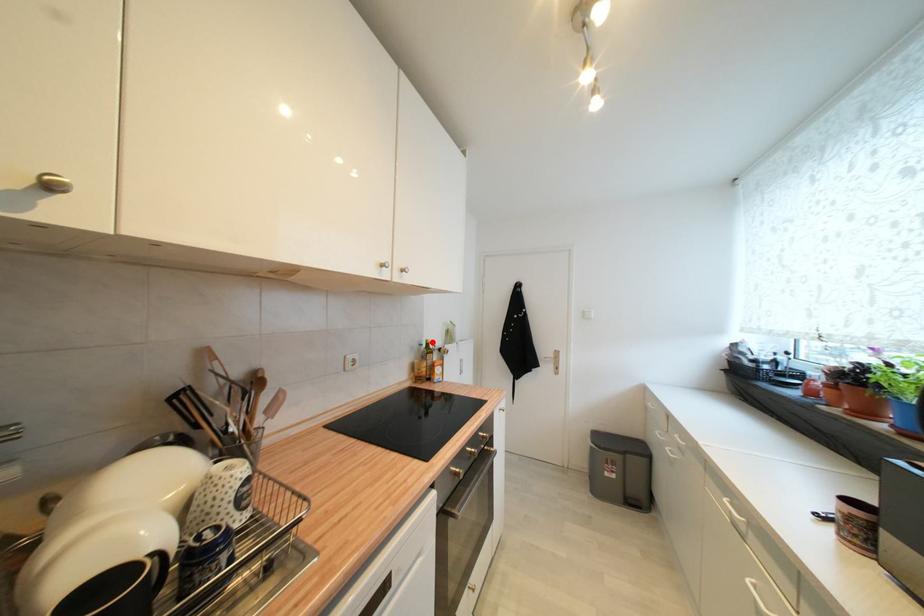
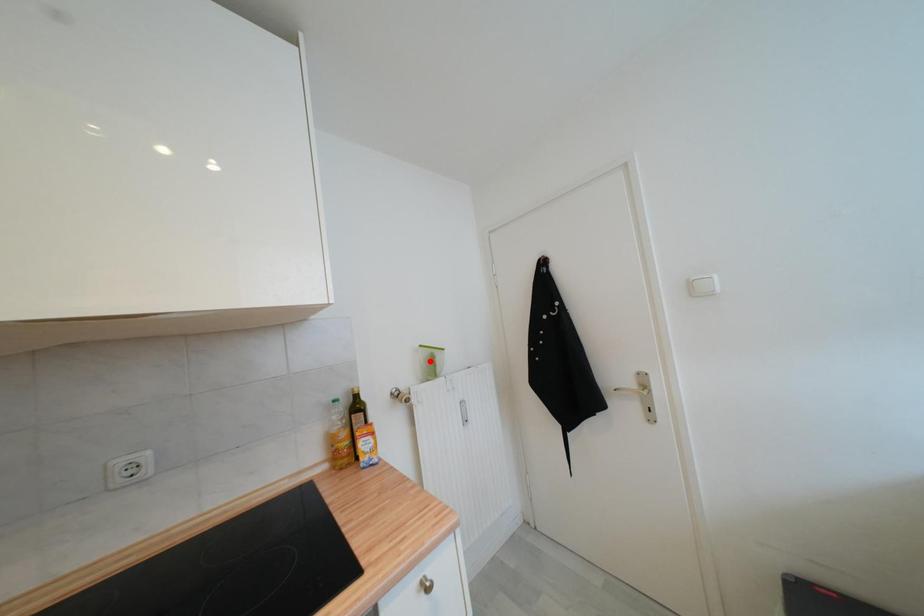
I am providing you with two images of the same scene from different viewpoints. A red point is marked on the first image and another point is marked on the second image. Does the point marked in image1 correspond to the same location as the one in image2?

No